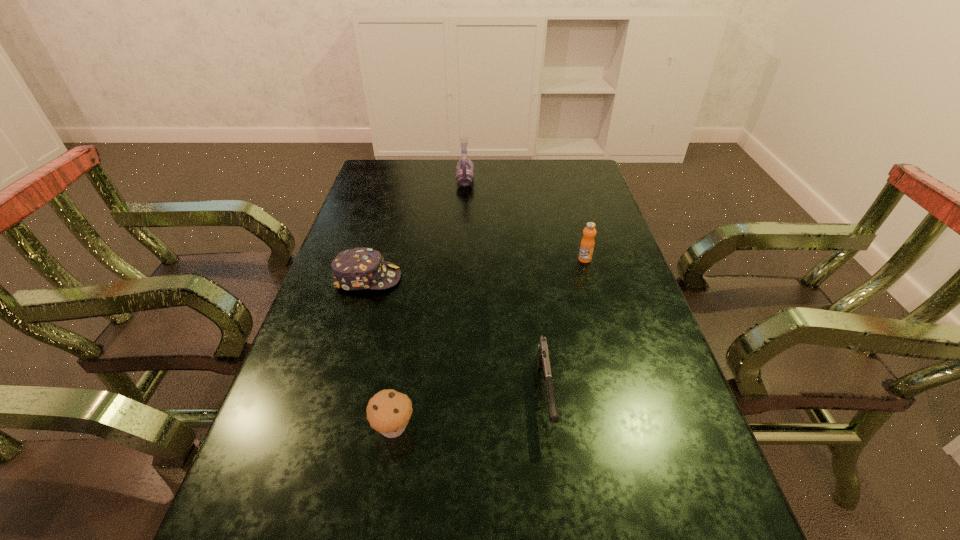
Identify the location of object that stands as the fourth closest to the fourth object from right to left. This screenshot has height=540, width=960. (465, 167).

Find the location of a particular element. The image size is (960, 540). object that stands as the fourth closest to the tallest object is located at coordinates (388, 412).

Where is `vacant space that satisfies the following two spatial constraints: 1. on the front-facing side of the fourth object from right to left; 2. on the left side of the headwear`? The image size is (960, 540). vacant space that satisfies the following two spatial constraints: 1. on the front-facing side of the fourth object from right to left; 2. on the left side of the headwear is located at coordinates click(x=324, y=427).

Find the location of `vacant space that satisfies the following two spatial constraints: 1. on the front label of the orange juice; 2. on the front-facing side of the leftmost object`. vacant space that satisfies the following two spatial constraints: 1. on the front label of the orange juice; 2. on the front-facing side of the leftmost object is located at coordinates (590, 278).

At what (x,y) coordinates should I click in order to perform the action: click on vacant space that satisfies the following two spatial constraints: 1. on the front-facing side of the muffin; 2. on the right side of the headwear. Please return your answer as a coordinate pair (x, y). Looking at the image, I should click on (324, 427).